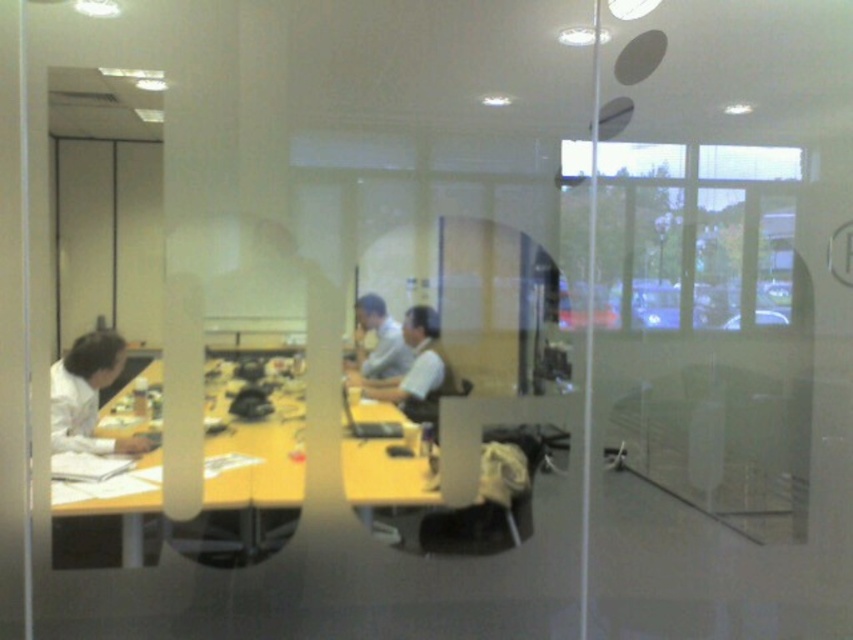
Is point (202, 534) positioned in front of point (357, 310)?

Yes, it is.

Is yellow matte table at lower left bigger than light gray shirt at center?

Yes.

Which is behind, point (236, 428) or point (380, 298)?

The point (380, 298) is behind.

Where is `yellow matte table at lower left`? yellow matte table at lower left is located at coordinates (204, 490).

Which of these two, light brown leather jacket at center or light gray shirt at center, stands taller?

light brown leather jacket at center

Does point (409, 336) lie behind point (378, 326)?

Yes, point (409, 336) is farther from viewer.

Which is in front, point (408, 410) or point (364, 353)?

Positioned in front is point (364, 353).

Identify the location of light brown leather jacket at center. (415, 369).

Is yellow matte table at lower left above white paper at left?

No, yellow matte table at lower left is not above white paper at left.

From the picture: Who is positioned more to the right, yellow matte table at lower left or white paper at left?

From the viewer's perspective, yellow matte table at lower left appears more on the right side.

Which is behind, point (120, 538) or point (54, 445)?

The point (120, 538) is behind.

Identify the location of yellow matte table at lower left. This screenshot has height=640, width=853. (204, 490).